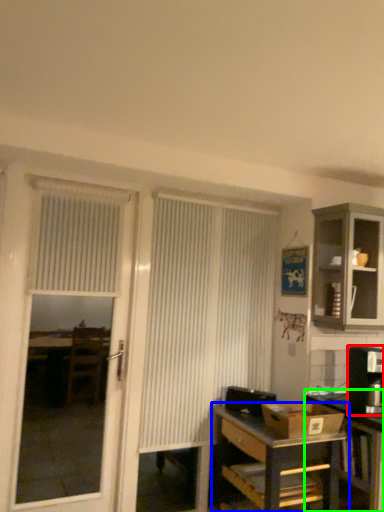
Question: Which object is the closest to the appliance (highlighted by a red box)? Choose among these: desk (highlighted by a blue box) or table (highlighted by a green box).

Choices:
 (A) desk
 (B) table

Answer: (B)